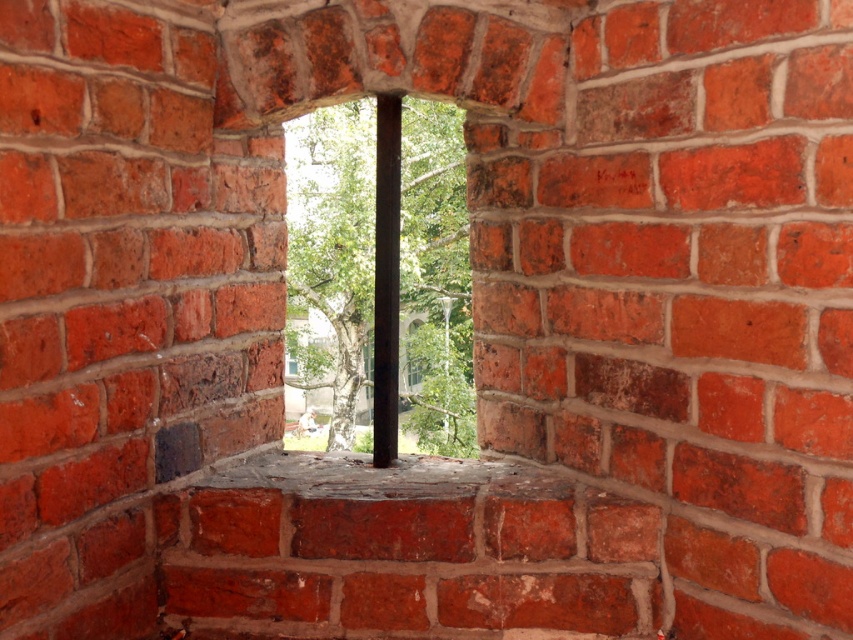
Question: Among these points, which one is farthest from the camera?

Choices:
 (A) (419, 268)
 (B) (167, 461)

Answer: (A)

Question: Where is transparent glass window at center located in relation to metallic gray hole at lower left in the image?

Choices:
 (A) left
 (B) right

Answer: (B)

Question: From the image, what is the correct spatial relationship of transparent glass window at center in relation to metallic gray hole at lower left?

Choices:
 (A) right
 (B) left

Answer: (A)

Question: Is transparent glass window at center bigger than metallic gray hole at lower left?

Choices:
 (A) yes
 (B) no

Answer: (A)

Question: Which point is closer to the camera taking this photo?

Choices:
 (A) click(434, 179)
 (B) click(190, 456)

Answer: (B)